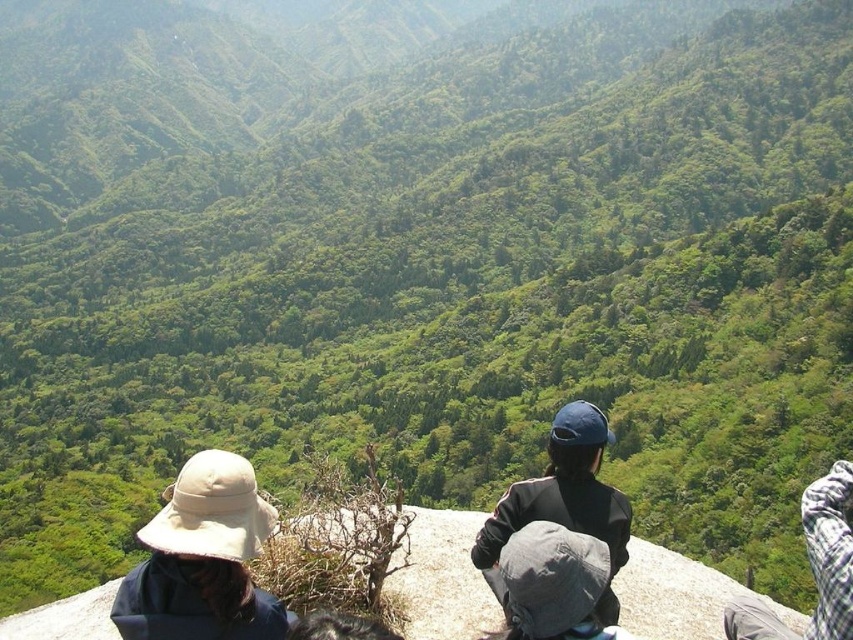
Question: Can you confirm if gray fabric hat at center is smaller than plaid fabric scarf at lower right?

Choices:
 (A) no
 (B) yes

Answer: (B)

Question: Which of the following is the farthest from the observer?

Choices:
 (A) (572, 531)
 (B) (845, 554)

Answer: (A)

Question: Which object is farther from the camera taking this photo?

Choices:
 (A) plaid fabric scarf at lower right
 (B) gray fabric hat at center

Answer: (A)

Question: Which object is closer to the camera taking this photo?

Choices:
 (A) dark blue fabric jacket at center
 (B) gray fabric hat at center

Answer: (B)

Question: Does beige fabric hat at lower left appear over plaid fabric scarf at lower right?

Choices:
 (A) no
 (B) yes

Answer: (B)

Question: Does beige fabric hat at lower left have a larger size compared to plaid fabric scarf at lower right?

Choices:
 (A) yes
 (B) no

Answer: (B)